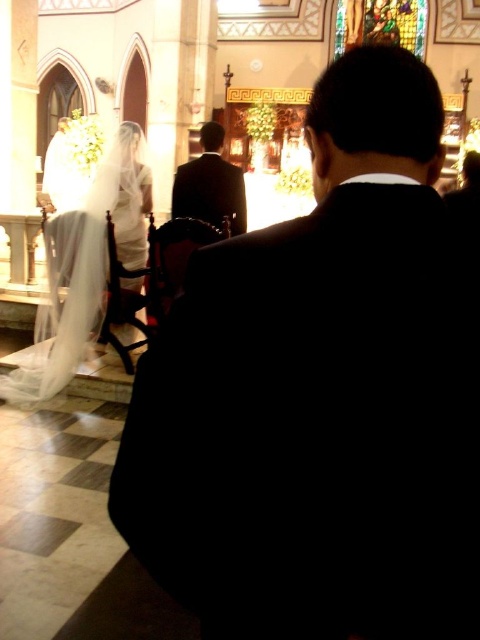
Question: Among these objects, which one is nearest to the camera?

Choices:
 (A) dark suit at center
 (B) white sheer veil at upper left
 (C) black suit at center

Answer: (C)

Question: Estimate the real-world distances between objects in this image. Which object is farther from the white sheer veil at upper left?

Choices:
 (A) dark suit at center
 (B) black suit at center

Answer: (B)

Question: Which point appears closest to the camera in this image?

Choices:
 (A) (36, 390)
 (B) (354, 68)

Answer: (B)

Question: Is black suit at center closer to camera compared to dark suit at center?

Choices:
 (A) yes
 (B) no

Answer: (A)

Question: Is black suit at center smaller than white sheer veil at upper left?

Choices:
 (A) yes
 (B) no

Answer: (A)

Question: Can you confirm if white sheer veil at upper left is bigger than dark suit at center?

Choices:
 (A) no
 (B) yes

Answer: (B)